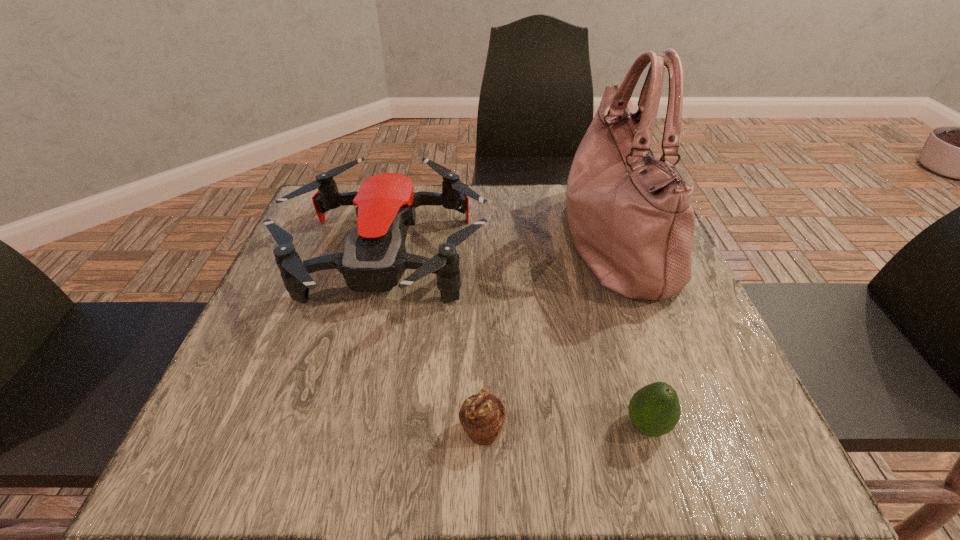
Locate an element on the screen. The image size is (960, 540). vacant region that satisfies the following two spatial constraints: 1. at the front of the tallest object with handles; 2. on the front side of the avocado is located at coordinates point(680,426).

This screenshot has width=960, height=540. I want to click on vacant region that satisfies the following two spatial constraints: 1. on the camera side of the drone; 2. on the left side of the muffin, so click(346, 431).

The height and width of the screenshot is (540, 960). Identify the location of blank area in the image that satisfies the following two spatial constraints: 1. at the front of the handbag with handles; 2. on the front side of the avocado. (680, 426).

The height and width of the screenshot is (540, 960). In order to click on vacant region that satisfies the following two spatial constraints: 1. on the camera side of the avocado; 2. on the right side of the drone in this screenshot , I will do `click(347, 426)`.